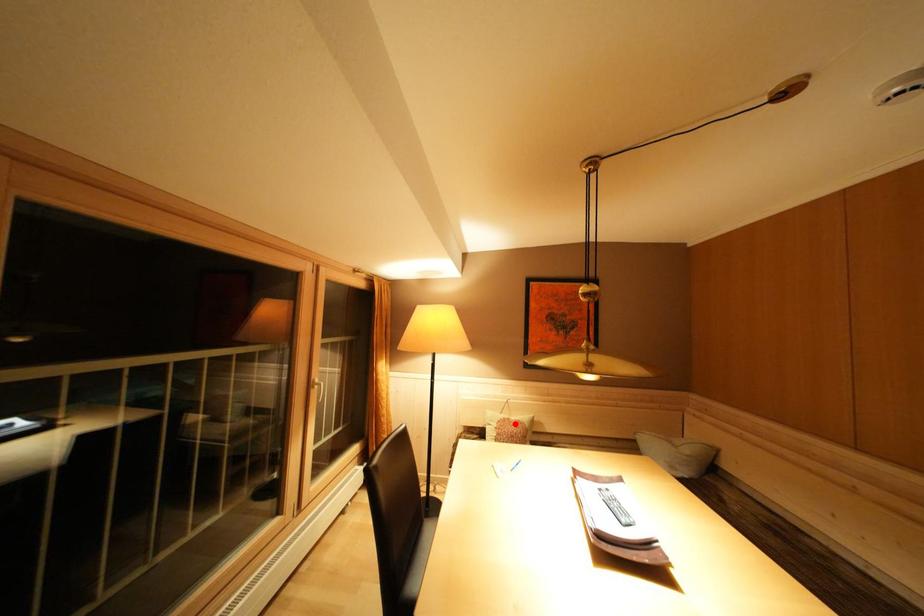
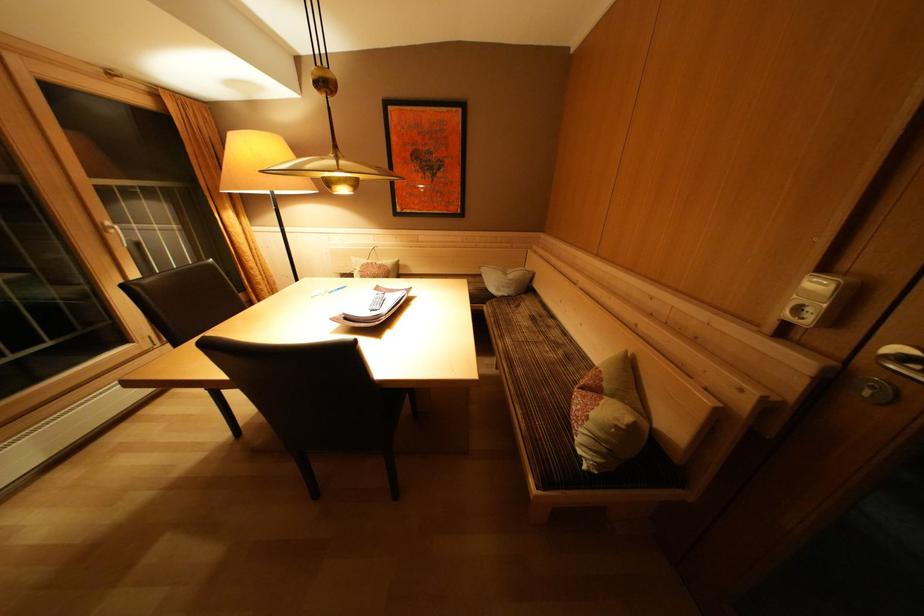
In the second image, find the point that corresponds to the highlighted location in the first image.

(379, 268)